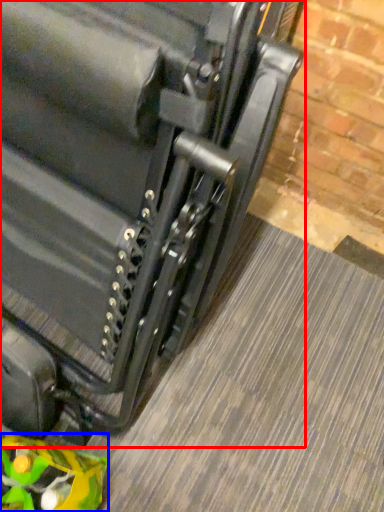
Question: Which object appears farthest to the camera in this image, suitcase (highlighted by a red box) or toy (highlighted by a blue box)?

Choices:
 (A) suitcase
 (B) toy

Answer: (B)